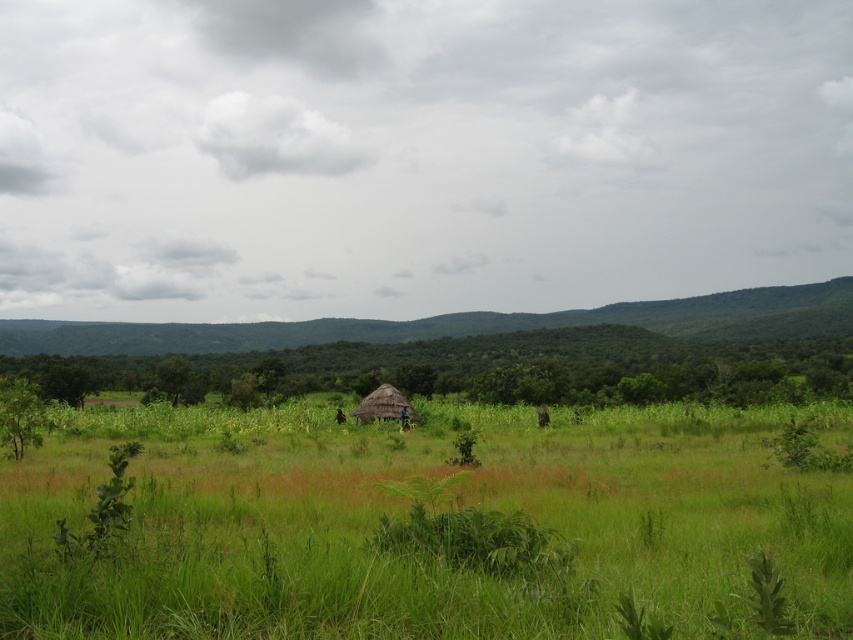
You are standing in the rural landscape and want to take a photo of both the green grassy field at center and the thatched straw hut at center. Which object should you focus on first to ensure both are in clear view?

You should focus on the thatched straw hut at center first because the green grassy field at center is closer to the viewer, so adjusting focus starting from the closer object ensures both are in clear view.

You are a photographer planning to capture the entire thatched straw hut at center and the green grassy field at center in a single frame. Given that your camera has a fixed focal length, which object should you position closer to the edge of the frame to ensure both fit?

The green grassy field at center is wider than the thatched straw hut at center. To ensure both fit in the frame, position the wider green grassy field at center closer to the edge of the frame so that its width accommodates within the camera view.